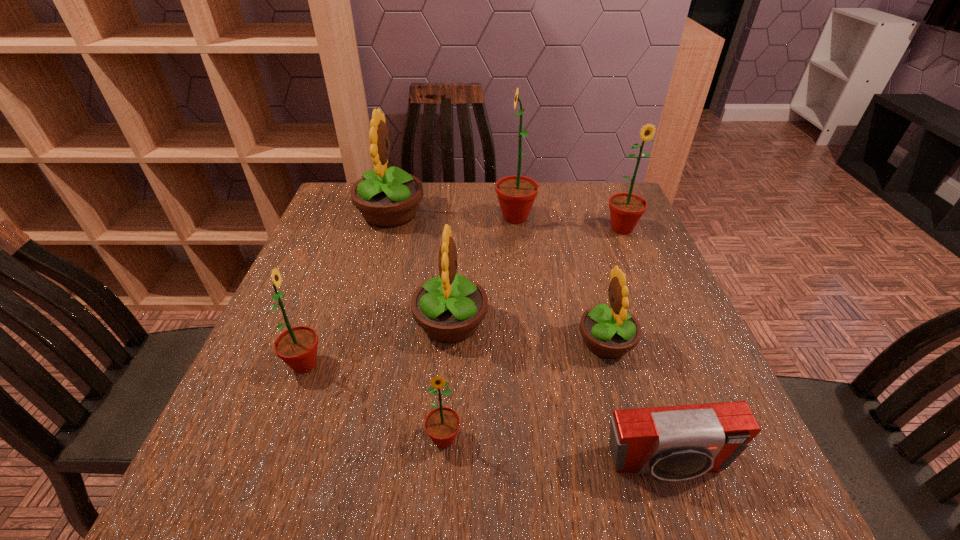
Locate an element on the screen. Image resolution: width=960 pixels, height=540 pixels. the rightmost yellow sunflower is located at coordinates (609, 331).

The image size is (960, 540). In order to click on the second green sunflower from left to right in this screenshot , I will do `click(442, 424)`.

This screenshot has height=540, width=960. I want to click on the nearest green sunflower, so click(442, 424).

Where is `the shortest object`? the shortest object is located at coordinates (673, 443).

Where is `free space located 0.270m on the face of the tallest sunflower`? The image size is (960, 540). free space located 0.270m on the face of the tallest sunflower is located at coordinates (398, 218).

The width and height of the screenshot is (960, 540). Find the location of `vacant space located 0.380m on the face of the tallest sunflower`. vacant space located 0.380m on the face of the tallest sunflower is located at coordinates (360, 218).

Where is `blank space located on the face of the tallest sunflower`? blank space located on the face of the tallest sunflower is located at coordinates (398, 218).

The width and height of the screenshot is (960, 540). Find the location of `free point located on the face of the leftmost yellow sunflower`. free point located on the face of the leftmost yellow sunflower is located at coordinates (554, 214).

I want to click on vacant space located 0.270m on the face of the rightmost sunflower, so click(657, 312).

Identify the location of vacant space positioned on the face of the second yellow sunflower from right to left. This screenshot has width=960, height=540. (520, 323).